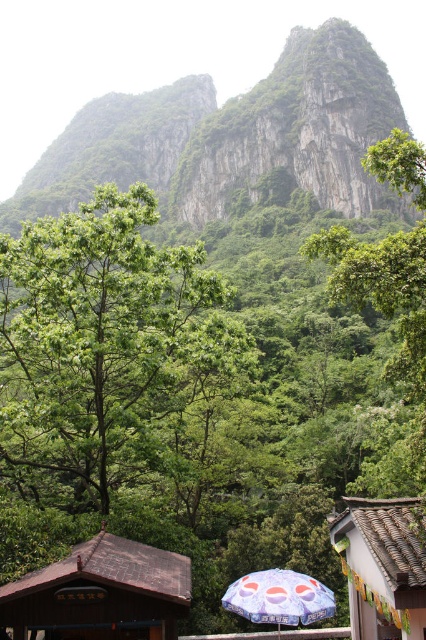
Question: Does green leafy tree at center have a smaller size compared to green rocky mountain at upper center?

Choices:
 (A) no
 (B) yes

Answer: (B)

Question: Considering the relative positions of brown wooden hut at lower left and brown tile roof at lower right in the image provided, where is brown wooden hut at lower left located with respect to brown tile roof at lower right?

Choices:
 (A) right
 (B) left

Answer: (B)

Question: Among these objects, which one is farthest from the camera?

Choices:
 (A) green leafy tree at center
 (B) green rocky mountain at upper center

Answer: (B)

Question: Based on their relative distances, which object is farther from the green leafy tree at center?

Choices:
 (A) blue printed umbrella at lower center
 (B) brown wooden hut at lower left
 (C) brown tile roof at lower right

Answer: (A)

Question: Does green leafy tree at center have a lesser width compared to brown tile roof at lower right?

Choices:
 (A) yes
 (B) no

Answer: (B)

Question: Among these objects, which one is farthest from the camera?

Choices:
 (A) blue printed umbrella at lower center
 (B) green leafy tree at center

Answer: (B)